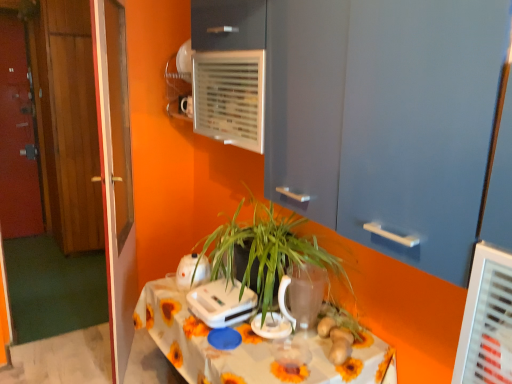
Find the location of a particular element. blank area to the left of brown matte ginger at center is located at coordinates (282, 365).